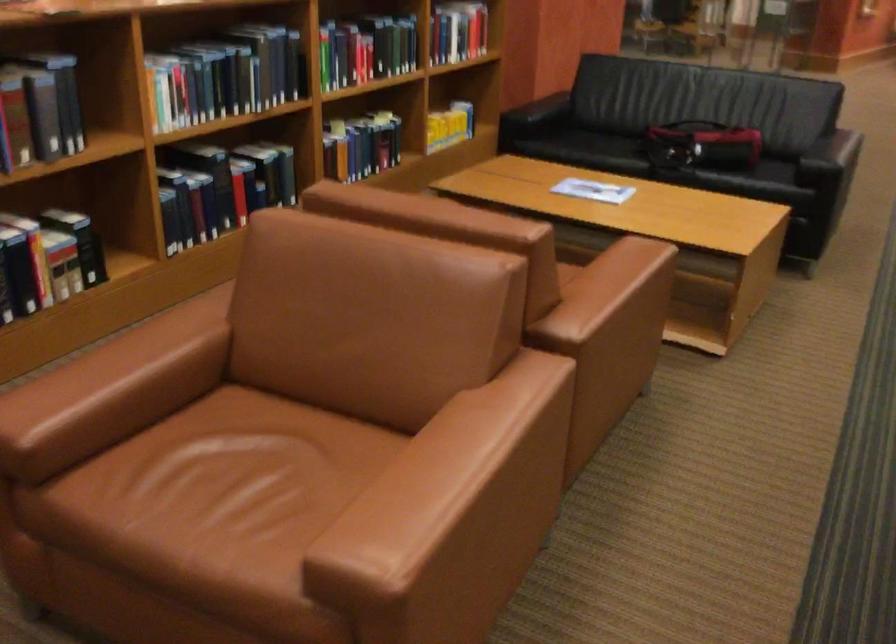
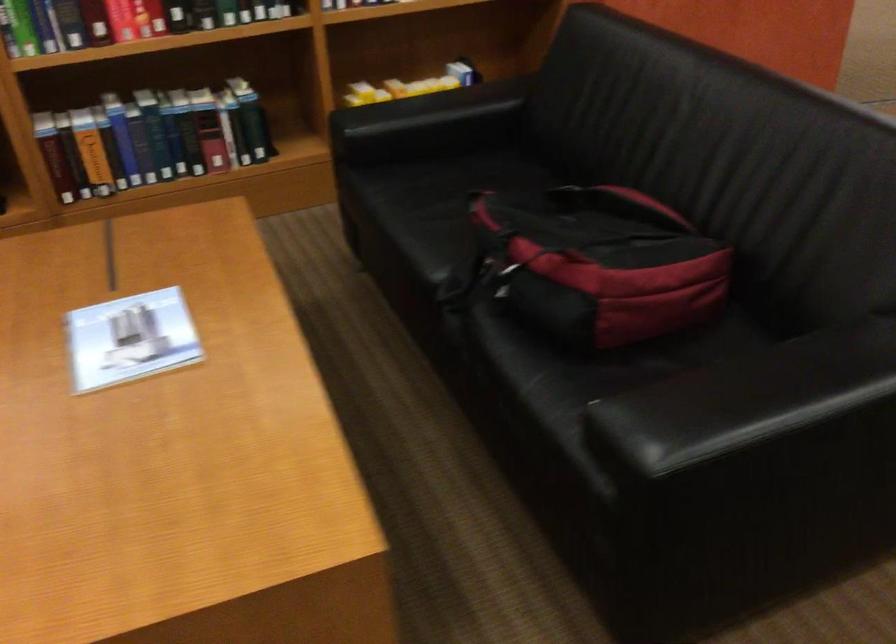
Find the pixel in the second image that matches the point at 451,111 in the first image.

(410, 86)